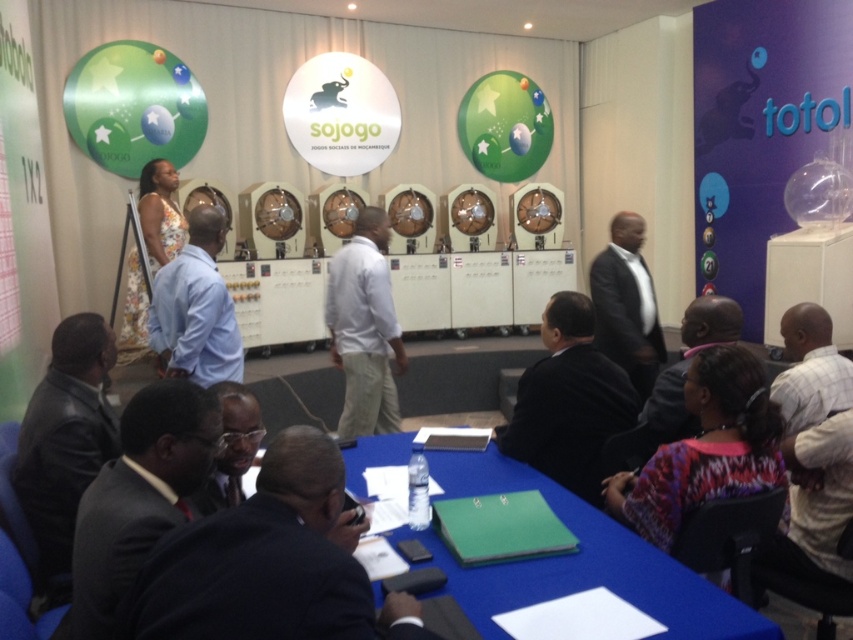
Does dark suit at lower center appear over white cotton shirt at center?

Actually, dark suit at lower center is below white cotton shirt at center.

Does dark suit at lower center appear on the left side of white cotton shirt at center?

Incorrect, dark suit at lower center is not on the left side of white cotton shirt at center.

What do you see at coordinates (270, 563) in the screenshot?
I see `dark suit at lower center` at bounding box center [270, 563].

Locate an element on the screen. The image size is (853, 640). dark suit at lower center is located at coordinates (270, 563).

Describe the element at coordinates (683, 372) in the screenshot. I see `dark gray suit at center` at that location.

Who is more distant from viewer, (676, 424) or (219, 477)?

The point (676, 424) is behind.

The height and width of the screenshot is (640, 853). Find the location of `dark gray suit at center`. dark gray suit at center is located at coordinates (683, 372).

Is the position of white cotton shirt at center more distant than that of plaid shirt at lower right?

Yes, white cotton shirt at center is behind plaid shirt at lower right.

The image size is (853, 640). Describe the element at coordinates (364, 328) in the screenshot. I see `white cotton shirt at center` at that location.

Consider the image. Who is more forward, (370, 262) or (782, 376)?

Point (782, 376) is more forward.

In order to click on white cotton shirt at center in this screenshot , I will do `click(364, 328)`.